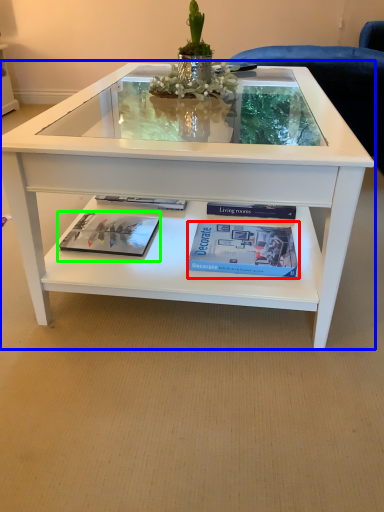
Question: Estimate the real-world distances between objects in this image. Which object is closer to paperback book (highlighted by a red box), coffee table (highlighted by a blue box) or magazine (highlighted by a green box)?

Choices:
 (A) coffee table
 (B) magazine

Answer: (A)